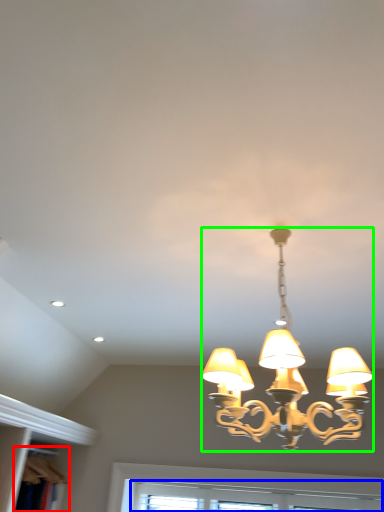
Question: Which object is positioned closest to bookshelf (highlighted by a red box)? Select from window (highlighted by a blue box) and lamp (highlighted by a green box).

Choices:
 (A) window
 (B) lamp

Answer: (A)